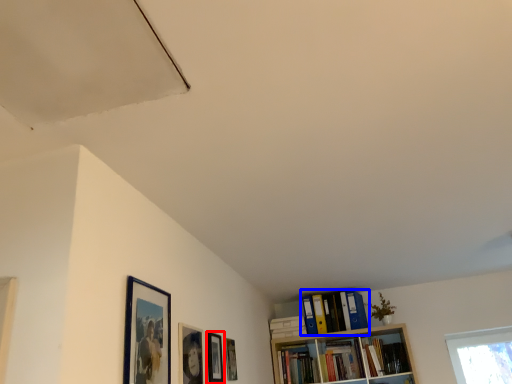
Question: Which object is further to the camera taking this photo, picture frame (highlighted by a red box) or book (highlighted by a blue box)?

Choices:
 (A) picture frame
 (B) book

Answer: (B)